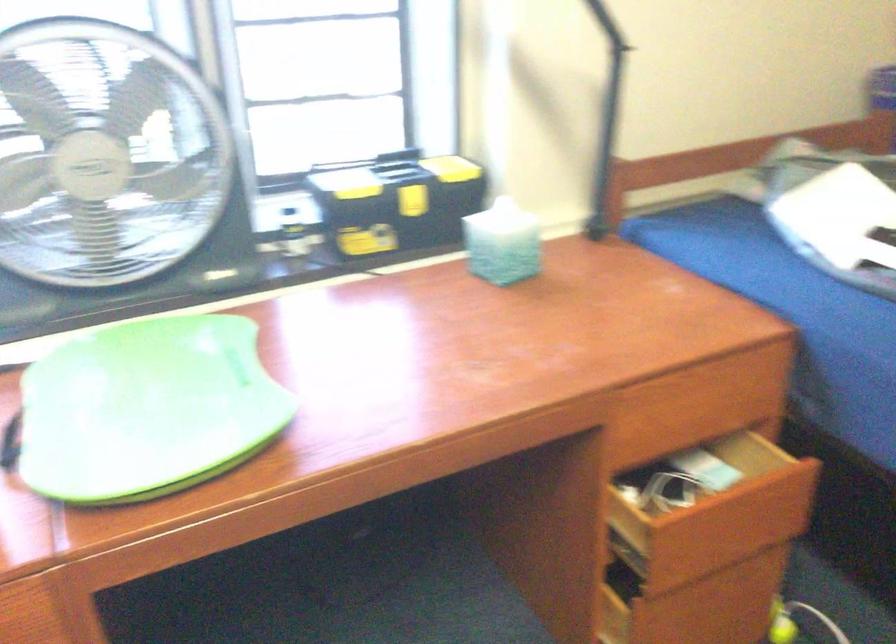
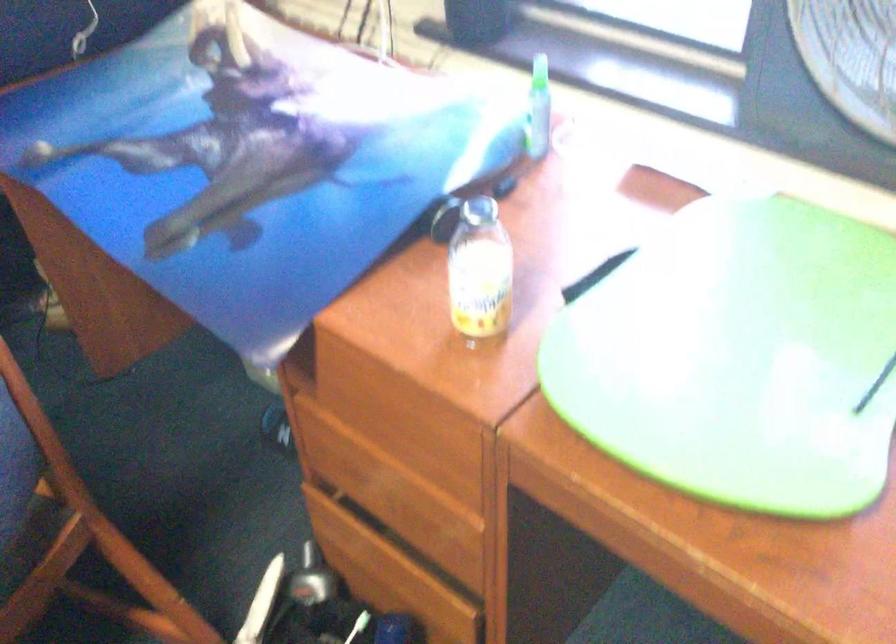
Based on the continuous images, in which direction is the camera rotating?

The camera rotated toward left-down.